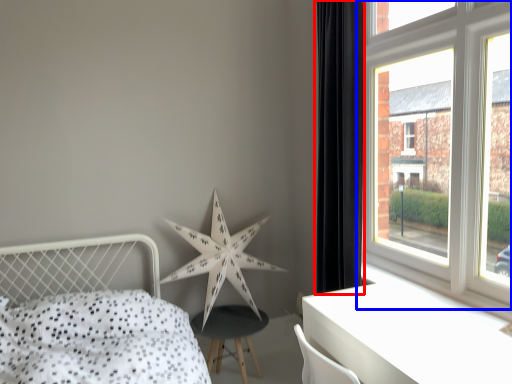
Question: Which object is closer to the camera taking this photo, curtain (highlighted by a red box) or window (highlighted by a blue box)?

Choices:
 (A) curtain
 (B) window

Answer: (B)